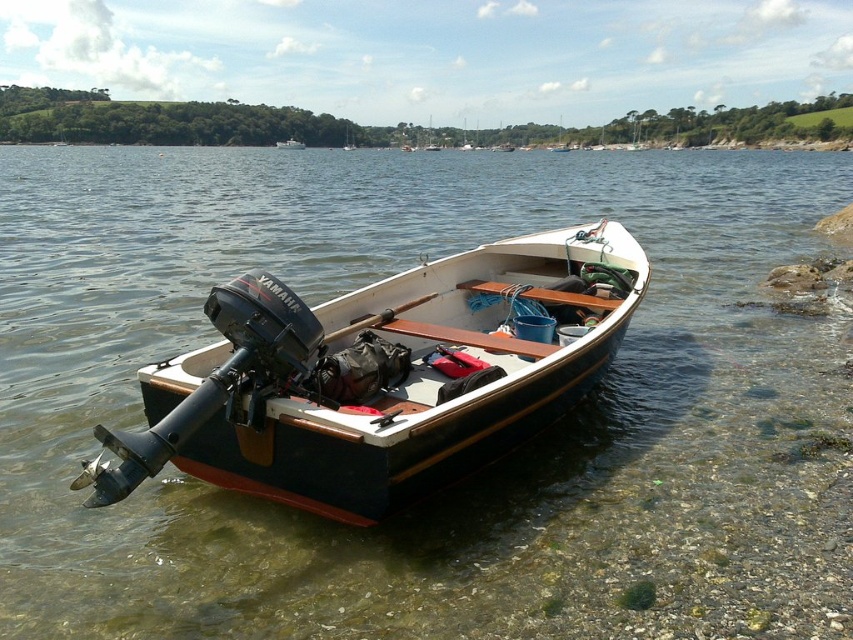
Question: Can you confirm if wooden boat at center is bigger than white plastic boat at center?

Choices:
 (A) no
 (B) yes

Answer: (A)

Question: Does wooden boat at center appear over white plastic boat at center?

Choices:
 (A) yes
 (B) no

Answer: (B)

Question: Can you confirm if wooden boat at center is bigger than white plastic boat at center?

Choices:
 (A) no
 (B) yes

Answer: (A)

Question: Which point is closer to the camera taking this photo?

Choices:
 (A) (260, 337)
 (B) (289, 141)

Answer: (A)

Question: Which point is closer to the camera?

Choices:
 (A) wooden boat at center
 (B) white plastic boat at center

Answer: (A)